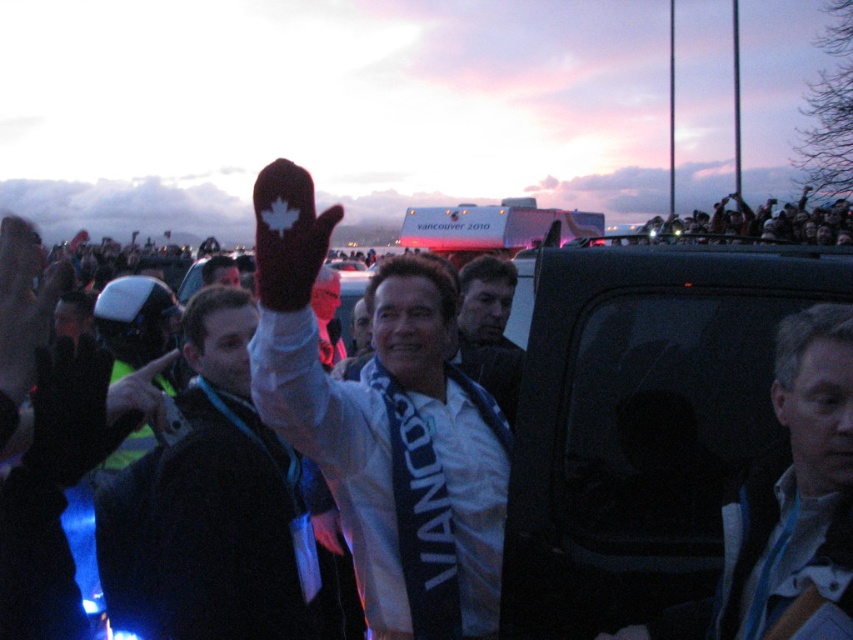
You are a photographer at the event and want to capture a photo where both the dark blue fabric jacket at upper left and the light blue fabric scarf at center are clearly visible. Based on their positions, which object should you focus on first to ensure both are in frame?

The dark blue fabric jacket at upper left is positioned under the light blue fabric scarf at center, so focusing on the scarf first will ensure both are in frame as the jacket is below it.

You are a photographer at the event and want to capture both the light blue fabric scarf at center and the dark blue fabric shirt at center in a single photo. Since the scarf is smaller, which object should you focus on to ensure both are clearly visible in the frame?

You should focus on the dark blue fabric shirt at center because the light blue fabric scarf at center is smaller in size and might be harder to see if the shirt is out of focus.

You are a photographer at the event and want to capture a closeup of the light blue fabric scarf at center and dark blue fabric shirt at center. Since you can only focus on one object at a time, which one should you choose to ensure it appears larger in the photo?

The light blue fabric scarf at center has a greater height compared to the dark blue fabric shirt at center, so you should focus on the light blue fabric scarf at center to ensure it appears larger in the photo.